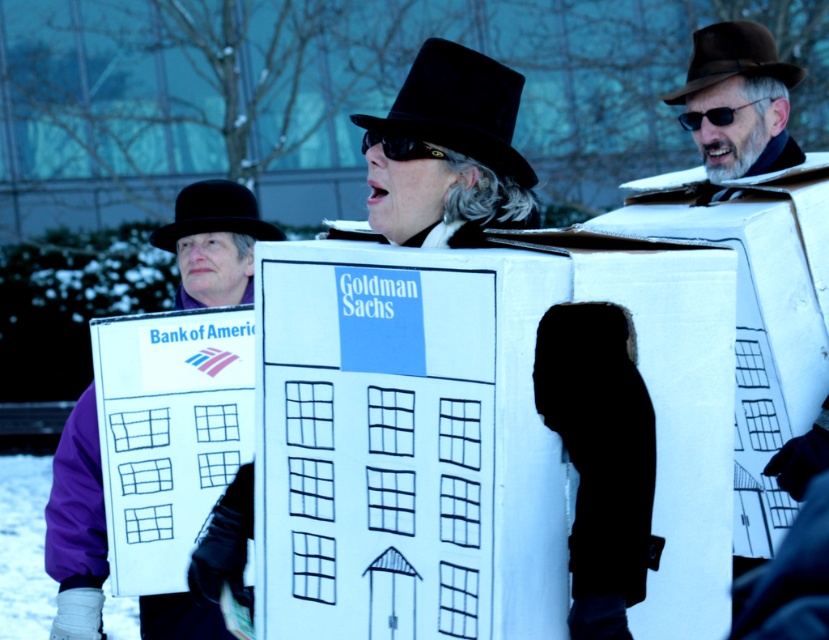
Is white cardboard sign at left below black felt dress hat at center?

Answer: Yes.

Is point (80, 456) more distant than point (365, 118)?

Yes.

Identify the location of white cardboard sign at left. The image size is (829, 640). (76, 516).

Is white cardboard sign at left above black matte goggles at center?

No, white cardboard sign at left is not above black matte goggles at center.

Between point (74, 456) and point (393, 154), which one is positioned behind?

Positioned behind is point (74, 456).

Find the location of a particular element. This screenshot has width=829, height=640. white cardboard sign at left is located at coordinates (76, 516).

Can you confirm if white cardboard at center is taller than black plastic sunglasses at center?

Yes.

Which is in front, point (696, 560) or point (759, 99)?

Point (696, 560) is in front.

Locate an element on the screen. The height and width of the screenshot is (640, 829). white cardboard at center is located at coordinates (473, 436).

What are the coordinates of `white cardboard at center` in the screenshot? It's located at (473, 436).